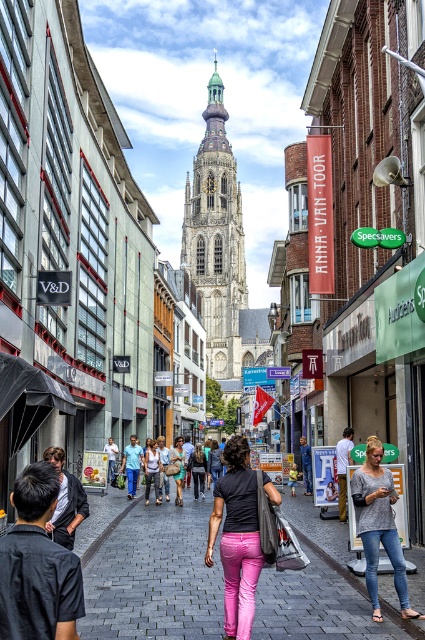
You are a photographer standing on a busy street in a European city. You notice two outfits in the crowd ahead of you. The first is pink fabric pants at center, and the second is matte black dress at center. From your position, which outfit is positioned more to the left?

The pink fabric pants at center is to the left of matte black dress at center, so the pink fabric pants at center is positioned more to the left.

You are standing on the pink fabric pants at center and want to walk to the paved stone sidewalk at center. In which direction should you move?

The paved stone sidewalk at center is to the right of the pink fabric pants at center, so you should move to your right to reach it.